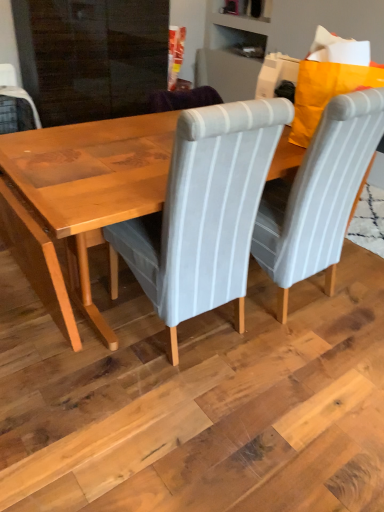
The height and width of the screenshot is (512, 384). What are the coordinates of `free space underneath gray striped fabric chair at center, which ranks as the second chair in left-to-right order (from a real-world perspective)` in the screenshot? It's located at (272, 292).